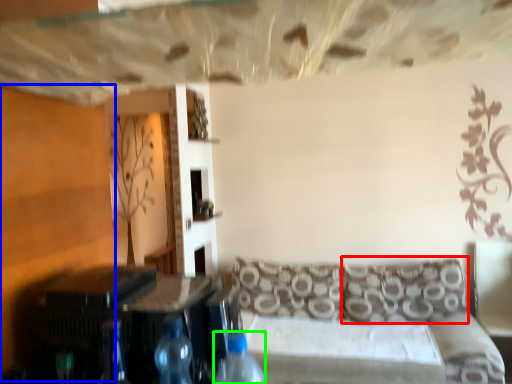
Question: Which object is the closest to the pillow (highlighted by a red box)? Choose among these: plywood (highlighted by a blue box) or bottle (highlighted by a green box).

Choices:
 (A) plywood
 (B) bottle

Answer: (B)